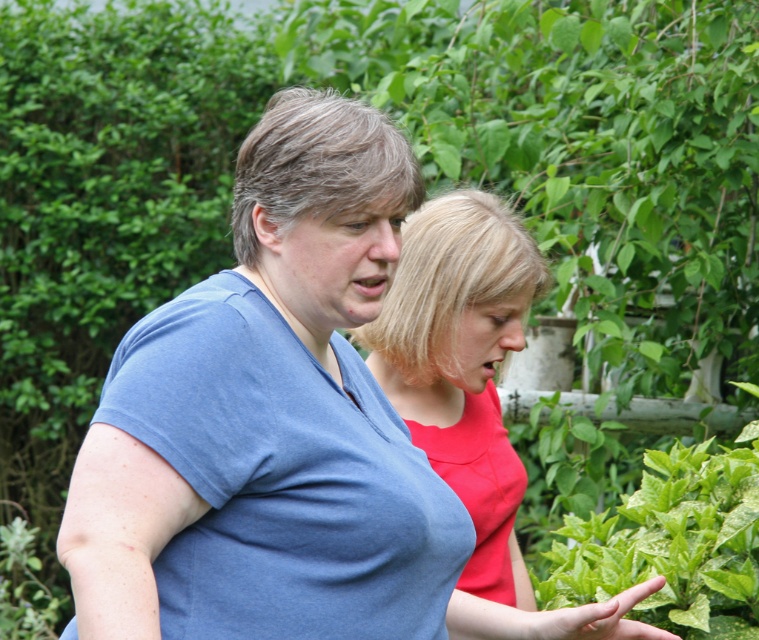
Question: Can you confirm if blue cotton shirt at center is thinner than green leafy plant at center?

Choices:
 (A) yes
 (B) no

Answer: (B)

Question: Which point appears closest to the camera in this image?

Choices:
 (A) (269, 349)
 (B) (446, 337)

Answer: (A)

Question: Does matte red blouse at center have a smaller size compared to green leafy plant at center?

Choices:
 (A) yes
 (B) no

Answer: (A)

Question: Considering the relative positions of blue cotton shirt at center and matte red blouse at center in the image provided, where is blue cotton shirt at center located with respect to matte red blouse at center?

Choices:
 (A) above
 (B) below

Answer: (A)

Question: Which point is closer to the camera taking this photo?

Choices:
 (A) (205, 532)
 (B) (449, 198)

Answer: (A)

Question: Among these points, which one is nearest to the camera?

Choices:
 (A) (454, 307)
 (B) (373, 557)

Answer: (B)